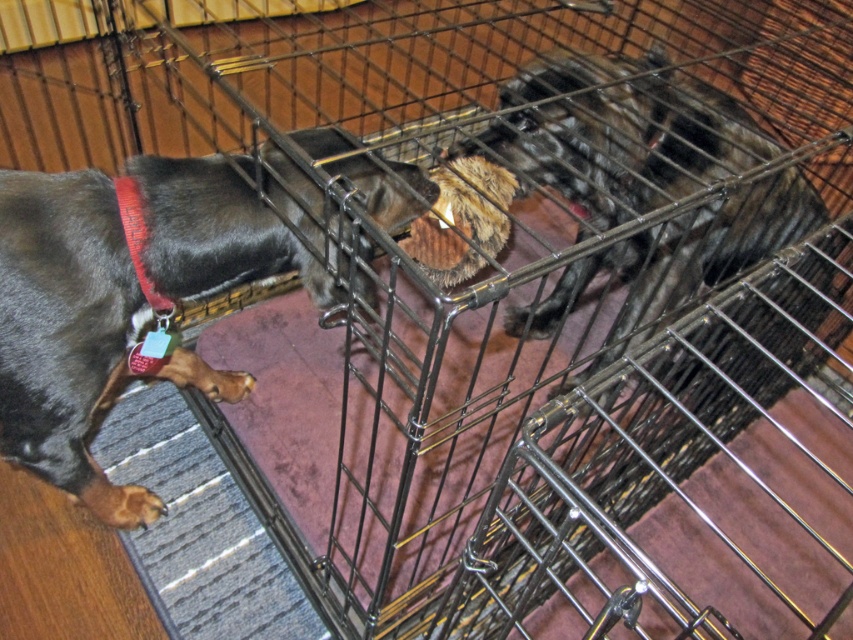
Question: Which point is farther from the camera taking this photo?

Choices:
 (A) (593, 113)
 (B) (134, 259)

Answer: (A)

Question: Does black fur dog at center appear under red fabric collar at left?

Choices:
 (A) yes
 (B) no

Answer: (B)

Question: Among these objects, which one is nearest to the camera?

Choices:
 (A) red fabric collar at left
 (B) black fur dog at center

Answer: (B)

Question: Estimate the real-world distances between objects in this image. Which object is closer to the black fur dog at center?

Choices:
 (A) shiny black fur at left
 (B) red fabric collar at left

Answer: (A)

Question: Is black fur dog at center in front of red fabric collar at left?

Choices:
 (A) yes
 (B) no

Answer: (A)

Question: Is black fur dog at center bigger than red fabric collar at left?

Choices:
 (A) yes
 (B) no

Answer: (A)